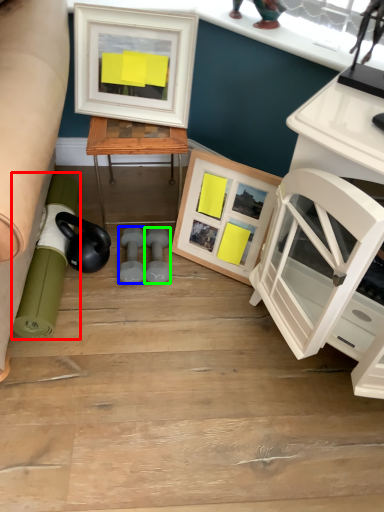
Question: Considering the real-world distances, which object is closest to rolling pin (highlighted by a red box)? dumbbell (highlighted by a blue box) or dumbbell (highlighted by a green box).

Choices:
 (A) dumbbell
 (B) dumbbell

Answer: (A)